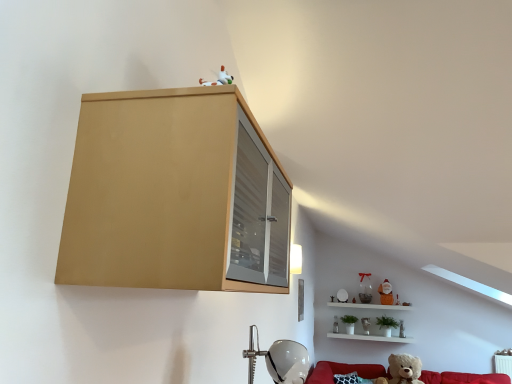
Question: Is translucent glass vase at lower right, which is counted as the 2th toy, starting from the front, positioned before matte wood cabinet at upper left?

Choices:
 (A) yes
 (B) no

Answer: (B)

Question: Is translucent glass vase at lower right, arranged as the fifth toy when viewed from the back, facing towards matte wood cabinet at upper left?

Choices:
 (A) yes
 (B) no

Answer: (A)

Question: From a real-world perspective, is translucent glass vase at lower right, arranged as the fifth toy when viewed from the back, positioned under matte wood cabinet at upper left based on gravity?

Choices:
 (A) no
 (B) yes

Answer: (B)

Question: From the image's perspective, is translucent glass vase at lower right, arranged as the fifth toy when viewed from the back, on matte wood cabinet at upper left?

Choices:
 (A) no
 (B) yes

Answer: (A)

Question: Is translucent glass vase at lower right, arranged as the fifth toy when viewed from the back, at the left side of matte wood cabinet at upper left?

Choices:
 (A) yes
 (B) no

Answer: (B)

Question: In terms of size, does matte wood cabinet at upper left appear bigger or smaller than matte white teddy bear at upper right, the first toy in the back-to-front sequence?

Choices:
 (A) small
 (B) big

Answer: (B)

Question: In terms of width, does matte wood cabinet at upper left look wider or thinner when compared to matte white teddy bear at upper right, the first toy in the back-to-front sequence?

Choices:
 (A) thin
 (B) wide

Answer: (B)

Question: Is matte wood cabinet at upper left taller or shorter than matte white teddy bear at upper right, which is the 6th toy from front to back?

Choices:
 (A) short
 (B) tall

Answer: (B)

Question: Does point [x=153, y=221] appear closer or farther from the camera than point [x=333, y=317]?

Choices:
 (A) closer
 (B) farther

Answer: (A)

Question: Is point (406, 340) positioned closer to the camera than point (402, 336)?

Choices:
 (A) closer
 (B) farther

Answer: (B)

Question: From the image's perspective, is white glossy shelf at lower right located above or below translucent glass vase at lower right, which is counted as the 2th toy, starting from the front?

Choices:
 (A) below
 (B) above

Answer: (B)

Question: Is white glossy shelf at lower right bigger or smaller than translucent glass vase at lower right, which is counted as the 2th toy, starting from the front?

Choices:
 (A) small
 (B) big

Answer: (B)

Question: From a real-world perspective, is white glossy shelf at lower right physically located above or below translucent glass vase at lower right, arranged as the fifth toy when viewed from the back?

Choices:
 (A) below
 (B) above

Answer: (B)

Question: Based on their positions, is matte wood cabinet at upper left located to the left or right of matte brown teddy bear at upper right, positioned as the third toy in back-to-front order?

Choices:
 (A) left
 (B) right

Answer: (A)

Question: Looking at the image, does matte wood cabinet at upper left seem bigger or smaller compared to matte brown teddy bear at upper right, positioned as the third toy in back-to-front order?

Choices:
 (A) big
 (B) small

Answer: (A)